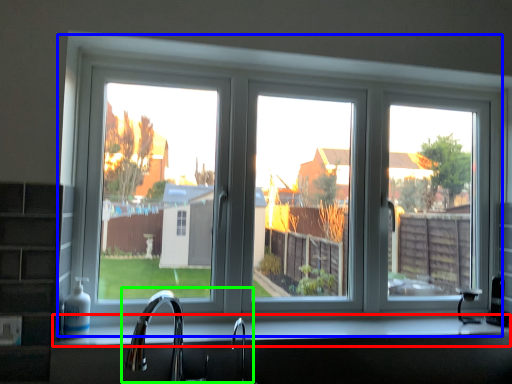
Question: Based on their relative distances, which object is nearer to counter top (highlighted by a red box)? Choose from window (highlighted by a blue box) and sink (highlighted by a green box).

Choices:
 (A) window
 (B) sink

Answer: (B)